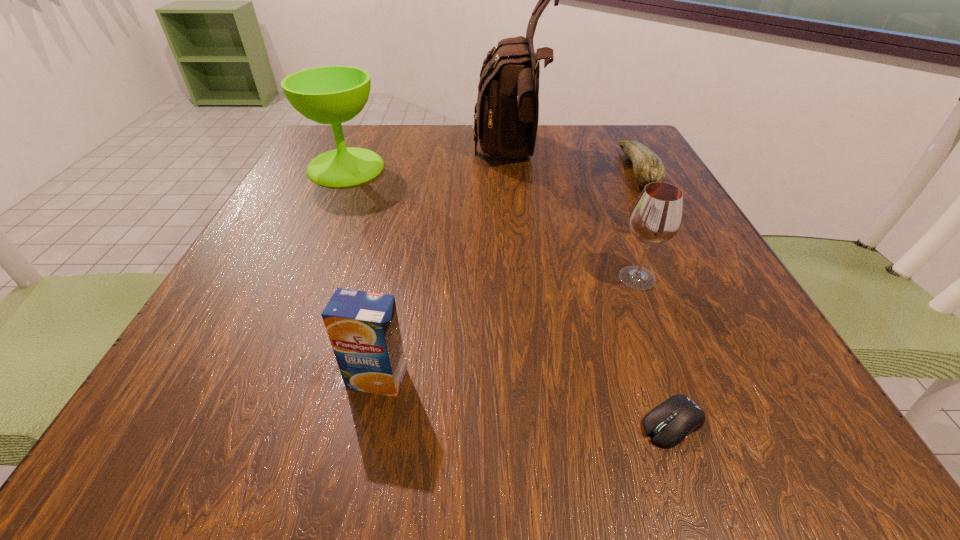
I want to click on computer equipment located in the right edge section of the desktop, so click(669, 423).

Identify the location of object present at the far left corner. (333, 95).

Locate an element on the screen. The image size is (960, 540). object at the far right corner is located at coordinates (647, 166).

This screenshot has height=540, width=960. I want to click on object present at the near right corner, so click(x=669, y=423).

This screenshot has height=540, width=960. I want to click on vacant space at the far edge of the desktop, so click(x=447, y=165).

At what (x,y) coordinates should I click in order to perform the action: click on blank space at the left edge of the desktop. Please return your answer as a coordinate pair (x, y). Looking at the image, I should click on (248, 313).

At what (x,y) coordinates should I click in order to perform the action: click on free space at the right edge of the desktop. Please return your answer as a coordinate pair (x, y). Looking at the image, I should click on [x=767, y=366].

Locate an element on the screen. The width and height of the screenshot is (960, 540). vacant area at the far left corner of the desktop is located at coordinates coord(370,141).

In the image, there is a desktop. Identify the location of vacant space at the near right corner. (761, 408).

In order to click on vacant space that is in between the fifth shortest object and the second object from left to right in this screenshot , I will do [x=361, y=273].